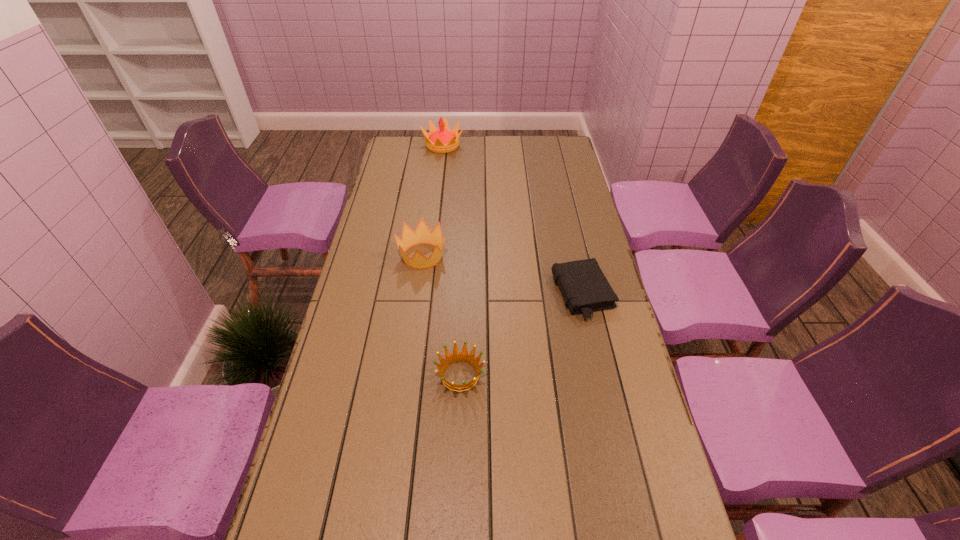
This screenshot has width=960, height=540. Identify the location of free space located on the right of the nearest object. (616, 375).

This screenshot has width=960, height=540. I want to click on free space located on the left of the shortest object, so click(x=451, y=294).

This screenshot has height=540, width=960. Find the location of `object present at the far edge`. object present at the far edge is located at coordinates (444, 140).

This screenshot has width=960, height=540. In order to click on object that is at the right edge in this screenshot , I will do `click(582, 283)`.

Identify the location of object present at the far left corner. This screenshot has width=960, height=540. (444, 140).

Find the location of `free point at the far edge`. free point at the far edge is located at coordinates (479, 140).

The image size is (960, 540). In order to click on vacant region at the left edge of the desktop in this screenshot , I will do `click(368, 285)`.

The image size is (960, 540). In the image, there is a desktop. What are the coordinates of `vacant region at the right edge` in the screenshot? It's located at (573, 165).

In the image, there is a desktop. Identify the location of vacant area at the far right corner. The image size is (960, 540). click(563, 157).

Identify the location of vacant region between the third shortest object and the Bible. This screenshot has height=540, width=960. (502, 275).